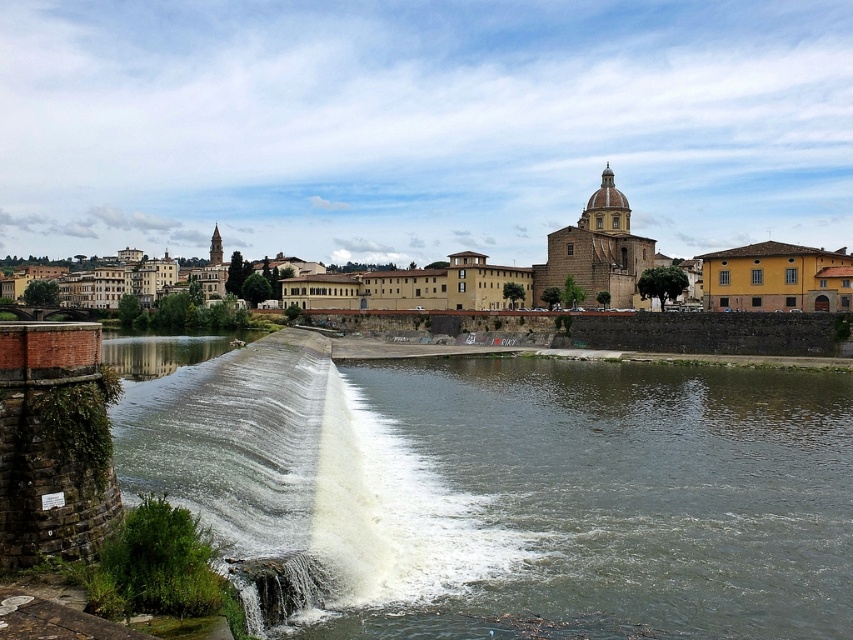
Question: Among these objects, which one is nearest to the camera?

Choices:
 (A) brown stone buildings at upper center
 (B) white frothy water at center

Answer: (B)

Question: Does white frothy water at center appear over brown stone buildings at upper center?

Choices:
 (A) no
 (B) yes

Answer: (A)

Question: Is white frothy water at center further to camera compared to brown stone buildings at upper center?

Choices:
 (A) yes
 (B) no

Answer: (B)

Question: Among these objects, which one is farthest from the camera?

Choices:
 (A) white frothy water at center
 (B) brown stone buildings at upper center

Answer: (B)

Question: Can you confirm if white frothy water at center is bigger than brown stone buildings at upper center?

Choices:
 (A) yes
 (B) no

Answer: (B)